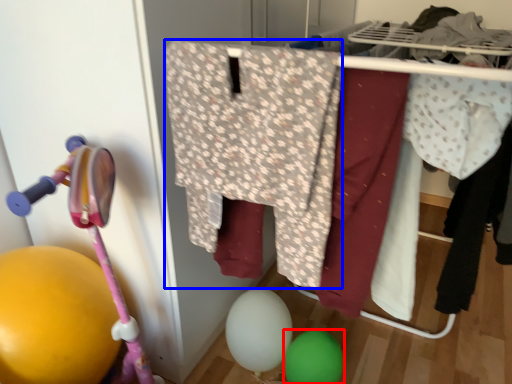
Question: Which object is further to the camera taking this photo, balloon (highlighted by a red box) or clothing (highlighted by a blue box)?

Choices:
 (A) balloon
 (B) clothing

Answer: (A)